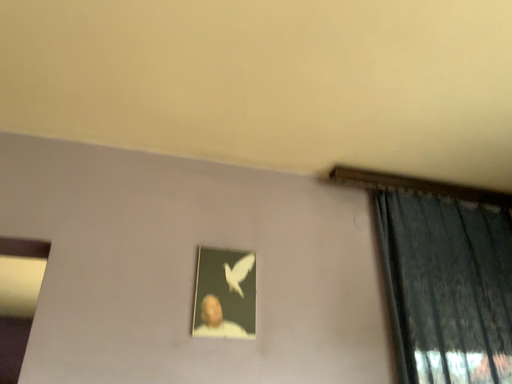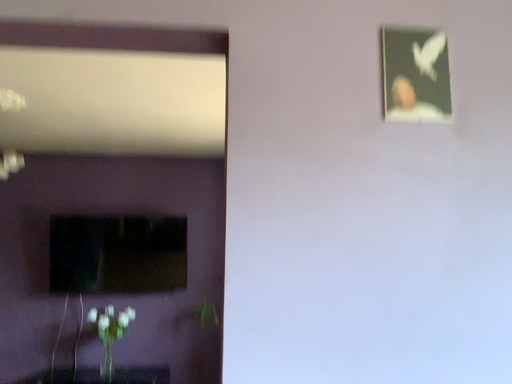
Question: How did the camera likely rotate when shooting the video?

Choices:
 (A) rotated left
 (B) rotated right

Answer: (A)